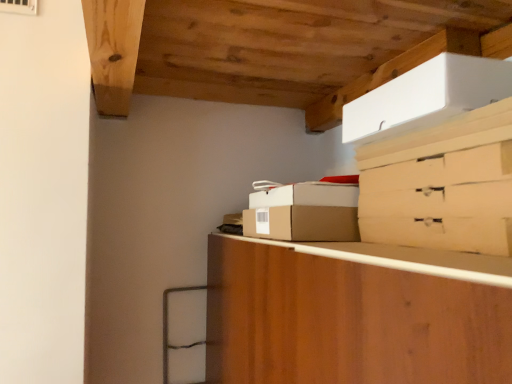
Question: Is brown cardboard box at center, placed as the 2th cardboard box when sorted from bottom to top, oriented towards white cardboard box at upper right, which is the third cardboard box in bottom-to-top order?

Choices:
 (A) yes
 (B) no

Answer: (B)

Question: Can you confirm if brown cardboard box at center, which appears as the second cardboard box when viewed from the top, is positioned to the left of white cardboard box at upper right, the first cardboard box in the top-to-bottom sequence?

Choices:
 (A) no
 (B) yes

Answer: (B)

Question: From the image's perspective, is brown cardboard box at center, placed as the 2th cardboard box when sorted from bottom to top, beneath white cardboard box at upper right, the first cardboard box in the top-to-bottom sequence?

Choices:
 (A) no
 (B) yes

Answer: (B)

Question: Is brown cardboard box at center, placed as the 2th cardboard box when sorted from bottom to top, not within white cardboard box at upper right, which is the third cardboard box in bottom-to-top order?

Choices:
 (A) no
 (B) yes

Answer: (B)

Question: Can you confirm if brown cardboard box at center, which appears as the second cardboard box when viewed from the top, is smaller than white cardboard box at upper right, which is the third cardboard box in bottom-to-top order?

Choices:
 (A) yes
 (B) no

Answer: (A)

Question: Is brown cardboard box at center, placed as the 2th cardboard box when sorted from bottom to top, positioned in front of white cardboard box at upper right, the first cardboard box in the top-to-bottom sequence?

Choices:
 (A) no
 (B) yes

Answer: (A)

Question: Is brown cardboard box at center, which is the 3th cardboard box in top-to-bottom order, positioned before matte cardboard drawer at upper right?

Choices:
 (A) no
 (B) yes

Answer: (A)

Question: From a real-world perspective, is brown cardboard box at center, which is the 3th cardboard box in top-to-bottom order, over matte cardboard drawer at upper right?

Choices:
 (A) yes
 (B) no

Answer: (A)

Question: Is brown cardboard box at center, which is the first cardboard box in bottom-to-top order, to the left of matte cardboard drawer at upper right from the viewer's perspective?

Choices:
 (A) yes
 (B) no

Answer: (A)

Question: From a real-world perspective, does brown cardboard box at center, which is the 3th cardboard box in top-to-bottom order, sit lower than matte cardboard drawer at upper right?

Choices:
 (A) yes
 (B) no

Answer: (B)

Question: Is brown cardboard box at center, which is the 3th cardboard box in top-to-bottom order, shorter than matte cardboard drawer at upper right?

Choices:
 (A) yes
 (B) no

Answer: (B)

Question: Is brown cardboard box at center, which is the 3th cardboard box in top-to-bottom order, thinner than matte cardboard drawer at upper right?

Choices:
 (A) no
 (B) yes

Answer: (B)

Question: Are white cardboard box at upper right, which is the third cardboard box in bottom-to-top order, and brown cardboard box at center, placed as the 2th cardboard box when sorted from bottom to top, far apart?

Choices:
 (A) yes
 (B) no

Answer: (B)